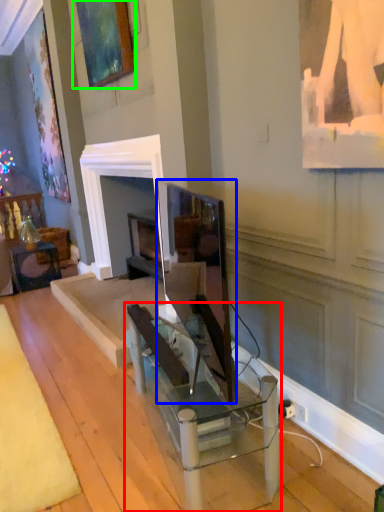
Question: Which object is the farthest from table (highlighted by a red box)? Choose among these: computer monitor (highlighted by a blue box) or picture frame (highlighted by a green box).

Choices:
 (A) computer monitor
 (B) picture frame

Answer: (B)